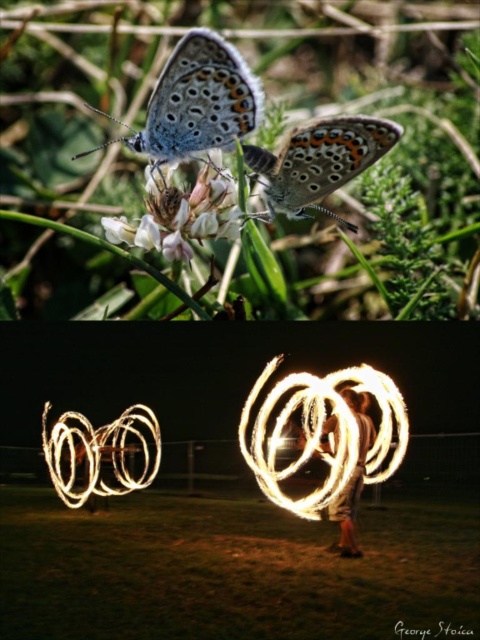
Consider the image. Is white matte flower at upper center shorter than fire spinner at center?

Correct, white matte flower at upper center is not as tall as fire spinner at center.

Is white matte flower at upper center wider than fire spinner at center?

Yes.

Locate an element on the screen. white matte flower at upper center is located at coordinates [x=180, y=212].

Does shiny metallic blue butterfly at upper left have a larger size compared to shiny metallic butterfly at upper center?

Indeed, shiny metallic blue butterfly at upper left has a larger size compared to shiny metallic butterfly at upper center.

Does shiny metallic blue butterfly at upper left have a lesser width compared to shiny metallic butterfly at upper center?

In fact, shiny metallic blue butterfly at upper left might be wider than shiny metallic butterfly at upper center.

Where is `shiny metallic blue butterfly at upper left`? This screenshot has width=480, height=640. shiny metallic blue butterfly at upper left is located at coordinates (196, 100).

Locate an element on the screen. shiny metallic blue butterfly at upper left is located at coordinates (196, 100).

Does green grass at lower center appear on the right side of shiny metallic butterfly at upper center?

No, green grass at lower center is not to the right of shiny metallic butterfly at upper center.

Does green grass at lower center have a lesser height compared to shiny metallic butterfly at upper center?

Yes, green grass at lower center is shorter than shiny metallic butterfly at upper center.

Is point (416, 509) positioned before point (282, 196)?

Yes, it is in front of point (282, 196).

The height and width of the screenshot is (640, 480). Find the location of `green grass at lower center`. green grass at lower center is located at coordinates (228, 570).